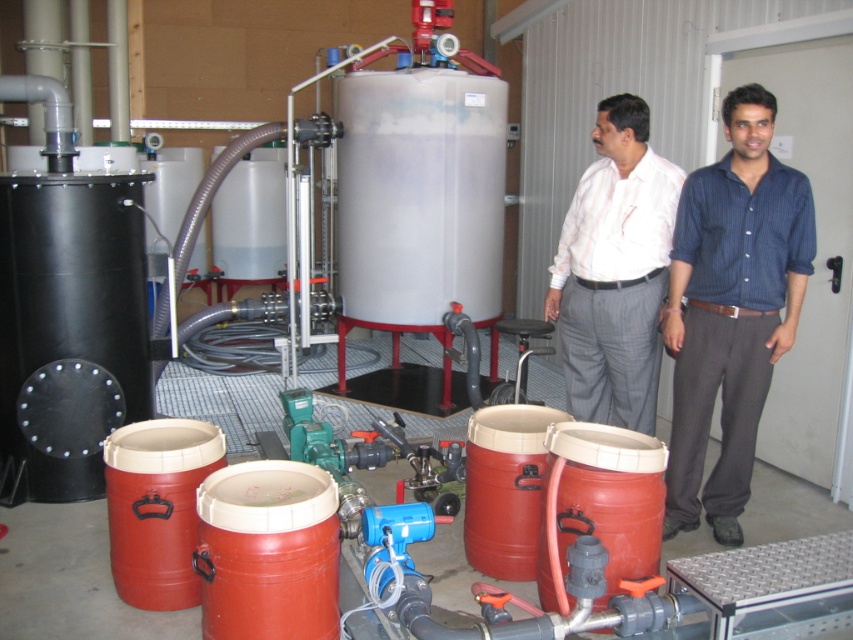
Question: Which point is farther to the camera?

Choices:
 (A) blue striped shirt at right
 (B) white striped shirt at center

Answer: (B)

Question: Can you confirm if blue striped shirt at right is positioned below white striped shirt at center?

Choices:
 (A) no
 (B) yes

Answer: (B)

Question: Is blue striped shirt at right smaller than white striped shirt at center?

Choices:
 (A) no
 (B) yes

Answer: (B)

Question: Which object is farther from the camera taking this photo?

Choices:
 (A) white striped shirt at center
 (B) blue striped shirt at right

Answer: (A)

Question: Does blue striped shirt at right appear over white striped shirt at center?

Choices:
 (A) yes
 (B) no

Answer: (B)

Question: Which point appears farthest from the camera in this image?

Choices:
 (A) (601, 324)
 (B) (764, 116)

Answer: (A)